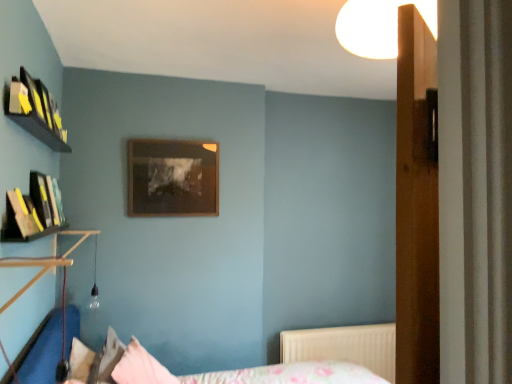
At what (x,y) coordinates should I click in order to perform the action: click on empty space that is ontop of white textured radiator at lower right (from a real-world perspective). Please return your answer as a coordinate pair (x, y). Image resolution: width=512 pixels, height=384 pixels. Looking at the image, I should click on (355, 324).